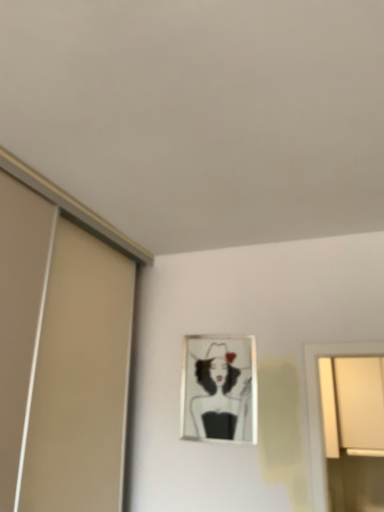
Question: From the image's perspective, does metallic silver picture frame at center appear higher than white matte window at upper right?

Choices:
 (A) no
 (B) yes

Answer: (B)

Question: Would you say metallic silver picture frame at center contains white matte window at upper right?

Choices:
 (A) no
 (B) yes

Answer: (A)

Question: Is the depth of metallic silver picture frame at center less than that of white matte window at upper right?

Choices:
 (A) no
 (B) yes

Answer: (B)

Question: Considering the relative positions of metallic silver picture frame at center and white matte window at upper right in the image provided, is metallic silver picture frame at center to the right of white matte window at upper right from the viewer's perspective?

Choices:
 (A) yes
 (B) no

Answer: (B)

Question: Is metallic silver picture frame at center outside of white matte window at upper right?

Choices:
 (A) yes
 (B) no

Answer: (A)

Question: Could you tell me if metallic silver picture frame at center is facing white matte window at upper right?

Choices:
 (A) no
 (B) yes

Answer: (A)

Question: From a real-world perspective, is white matte window at upper right located higher than metallic silver picture frame at center?

Choices:
 (A) yes
 (B) no

Answer: (B)

Question: Can you see white matte window at upper right touching metallic silver picture frame at center?

Choices:
 (A) yes
 (B) no

Answer: (B)

Question: Does white matte window at upper right have a greater height compared to metallic silver picture frame at center?

Choices:
 (A) yes
 (B) no

Answer: (A)

Question: Does white matte window at upper right have a smaller size compared to metallic silver picture frame at center?

Choices:
 (A) yes
 (B) no

Answer: (B)

Question: Does white matte window at upper right have a lesser height compared to metallic silver picture frame at center?

Choices:
 (A) no
 (B) yes

Answer: (A)

Question: Does white matte window at upper right appear on the right side of metallic silver picture frame at center?

Choices:
 (A) yes
 (B) no

Answer: (A)

Question: Is point (215, 434) positioned closer to the camera than point (354, 370)?

Choices:
 (A) closer
 (B) farther

Answer: (A)